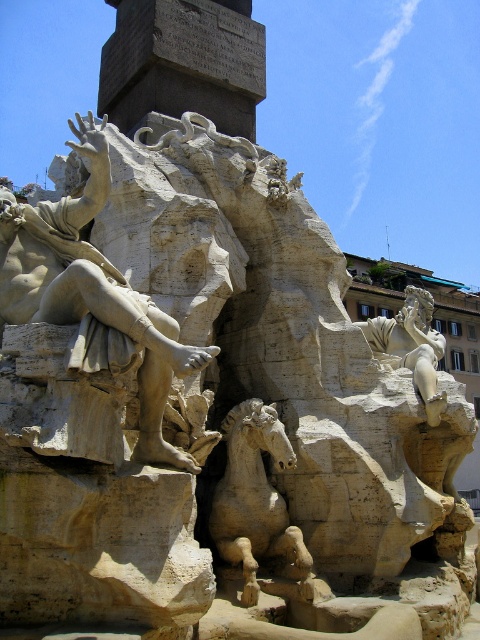
You are standing at the point labeled as point (91, 330). A friend is standing at another point 49.91 meters away from you. Given the scene described, where might your friend be located?

Your friend is located at the point labeled as point (91, 330) plus or minus 49.91 meters in any direction, but since the scene only mentions one point, it is unclear without additional context.

You are an art conservator examining the sculpture from a distance. You notice two points on the sculpture marked as point 1 at coordinates (x=142, y=365) and point 2 at coordinates (x=435, y=353). Which point is closer to your viewpoint?

Point 1 at coordinates (x=142, y=365) is closer to the camera than point 2 at coordinates (x=435, y=353).

You are an art conservator examining the sculpture. You need to move a protective cover from the white marble statue at left to the white stone horse at center. Based on their positions, which direction should you move the cover?

The white marble statue at left is positioned on the left side of the white stone horse at center, so you should move the cover to the right to place it over the white stone horse at center.